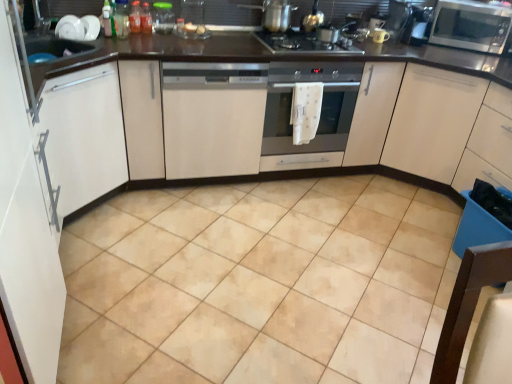
Measure the distance between point (125, 157) and camera.

Point (125, 157) and camera are 2.46 meters apart.

Identify the location of metallic gold kettle at upper center, the second appliance from the right. This screenshot has height=384, width=512. (313, 19).

Locate an element on the screen. This screenshot has width=512, height=384. translucent plastic bottle at upper center, the 1th bottle positioned from the right is located at coordinates (146, 19).

Find the location of a particular element. The width and height of the screenshot is (512, 384). white matte cabinet at left, which is the 2th cabinetry from left to right is located at coordinates (26, 229).

How much space does white matte cabinet at left, which ranks as the third cabinetry in right-to-left order, occupy horizontally?

white matte cabinet at left, which ranks as the third cabinetry in right-to-left order, is 13.08 inches in width.

Identify the location of white glossy cabinet at left, which is counted as the 1th cabinetry, starting from the left. (84, 135).

Is translucent plastic bottle at upper center, marked as the third bottle in a left-to-right arrangement, further to camera compared to matte ceramic mug at upper center, the first appliance from the right?

No, it is not.

Would you say translucent plastic bottle at upper center, the 1th bottle positioned from the right, contains matte ceramic mug at upper center, the first appliance from the right?

No, translucent plastic bottle at upper center, the 1th bottle positioned from the right, does not contain matte ceramic mug at upper center, the first appliance from the right.

Which is farther from the camera, (143,5) or (375,37)?

Positioned behind is point (375,37).

Which is more to the left, beige ceramic tile at center or matte white cabinet at right, which ranks as the fourth cabinetry in left-to-right order?

beige ceramic tile at center.

How different are the orientations of beige ceramic tile at center and matte white cabinet at right, which is counted as the first cabinetry, starting from the right, in degrees?

They differ by 88.3 degrees in their facing directions.

Is beige ceramic tile at center closer to camera compared to matte white cabinet at right, which is counted as the first cabinetry, starting from the right?

Yes, beige ceramic tile at center is closer to the camera.

From the image's perspective, starting from the beige ceramic tile at center, which bottle is the 1st one above? Please provide its 2D coordinates.

[(121, 19)]

Is beige ceramic tile at center not inside translucent plastic bottle at upper center, arranged as the first bottle when viewed from the left?

Indeed, beige ceramic tile at center is completely outside translucent plastic bottle at upper center, arranged as the first bottle when viewed from the left.

Measure the distance between beige ceramic tile at center and translucent plastic bottle at upper center, which is counted as the third bottle, starting from the right.

beige ceramic tile at center and translucent plastic bottle at upper center, which is counted as the third bottle, starting from the right, are 5.20 feet apart.

Is the depth of beige ceramic tile at center less than that of translucent plastic bottle at upper center, arranged as the first bottle when viewed from the left?

Yes, beige ceramic tile at center is in front of translucent plastic bottle at upper center, arranged as the first bottle when viewed from the left.

Based on the photo, from a real-world perspective, who is located higher, satin silver microwave at upper right or white glossy cabinet at left, which is counted as the 1th cabinetry, starting from the left?

satin silver microwave at upper right is physically above.

Can you confirm if satin silver microwave at upper right is positioned to the left of white glossy cabinet at left, which is counted as the 1th cabinetry, starting from the left?

No, satin silver microwave at upper right is not to the left of white glossy cabinet at left, which is counted as the 1th cabinetry, starting from the left.

Which point is more distant from viewer, (476,47) or (70,174)?

Positioned behind is point (476,47).

Which object is closer to the camera, satin silver microwave at upper right or white glossy cabinet at left, positioned as the fourth cabinetry in right-to-left order?

Positioned in front is white glossy cabinet at left, positioned as the fourth cabinetry in right-to-left order.

Is matte white cabinet at right, which ranks as the fourth cabinetry in left-to-right order, positioned behind satin silver oven at center?

Yes, matte white cabinet at right, which ranks as the fourth cabinetry in left-to-right order, is behind satin silver oven at center.

Considering the relative sizes of matte white cabinet at right, which ranks as the fourth cabinetry in left-to-right order, and satin silver oven at center in the image provided, is matte white cabinet at right, which ranks as the fourth cabinetry in left-to-right order, bigger than satin silver oven at center?

Correct, matte white cabinet at right, which ranks as the fourth cabinetry in left-to-right order, is larger in size than satin silver oven at center.

Based on the photo, can you confirm if matte white cabinet at right, which ranks as the fourth cabinetry in left-to-right order, is taller than satin silver oven at center?

Correct, matte white cabinet at right, which ranks as the fourth cabinetry in left-to-right order, is much taller as satin silver oven at center.

From a real-world perspective, does matte white cabinet at right, which ranks as the fourth cabinetry in left-to-right order, stand above satin silver oven at center?

No.

Is white glossy cabinet at left, positioned as the fourth cabinetry in right-to-left order, facing towards translucent plastic bottle at upper center, the 1th bottle positioned from the right?

No.

Based on the photo, which is in front, white glossy cabinet at left, positioned as the fourth cabinetry in right-to-left order, or translucent plastic bottle at upper center, the 1th bottle positioned from the right?

white glossy cabinet at left, positioned as the fourth cabinetry in right-to-left order, is in front.

Is white glossy cabinet at left, positioned as the fourth cabinetry in right-to-left order, with translucent plastic bottle at upper center, the 1th bottle positioned from the right?

They are not placed beside each other.

In the scene shown: Between white glossy cabinet at left, positioned as the fourth cabinetry in right-to-left order, and translucent plastic bottle at upper center, marked as the third bottle in a left-to-right arrangement, which one appears on the right side from the viewer's perspective?

translucent plastic bottle at upper center, marked as the third bottle in a left-to-right arrangement, is more to the right.

How many degrees apart are the facing directions of translucent plastic bottle at upper center, which is counted as the third bottle, starting from the right, and matte ceramic mug at upper center, the first appliance from the right?

translucent plastic bottle at upper center, which is counted as the third bottle, starting from the right, and matte ceramic mug at upper center, the first appliance from the right, are facing 18.9 degrees away from each other.

Considering the relative sizes of translucent plastic bottle at upper center, which is counted as the third bottle, starting from the right, and matte ceramic mug at upper center, marked as the third appliance in a left-to-right arrangement, in the image provided, is translucent plastic bottle at upper center, which is counted as the third bottle, starting from the right, bigger than matte ceramic mug at upper center, marked as the third appliance in a left-to-right arrangement,?

Yes.

Measure the distance between translucent plastic bottle at upper center, which is counted as the third bottle, starting from the right, and matte ceramic mug at upper center, the first appliance from the right.

translucent plastic bottle at upper center, which is counted as the third bottle, starting from the right, is 1.60 meters away from matte ceramic mug at upper center, the first appliance from the right.

From the image's perspective, between translucent plastic bottle at upper center, which is counted as the third bottle, starting from the right, and matte ceramic mug at upper center, marked as the third appliance in a left-to-right arrangement, who is located below?

From the image's view, translucent plastic bottle at upper center, which is counted as the third bottle, starting from the right, is below.

Where is `the 3rd appliance to the right of the translucent plastic bottle at upper center, the 1th bottle positioned from the right, starting your count from the anchor`? the 3rd appliance to the right of the translucent plastic bottle at upper center, the 1th bottle positioned from the right, starting your count from the anchor is located at coordinates (380, 35).

The width and height of the screenshot is (512, 384). What are the coordinates of `ceramic tile that is in front of the matte white cabinet at right, which ranks as the fourth cabinetry in left-to-right order` in the screenshot? It's located at (258, 284).

Which object lies nearer to the anchor point satin silver microwave at upper right, beige ceramic tile at center or translucent plastic bottle at upper center, which is counted as the third bottle, starting from the right?

beige ceramic tile at center is closer to satin silver microwave at upper right.

Which object lies further to the anchor point matte ceramic mug at upper center, the first appliance from the right, white glossy cabinet at left, positioned as the fourth cabinetry in right-to-left order, or matte white cabinet at right, which ranks as the fourth cabinetry in left-to-right order?

white glossy cabinet at left, positioned as the fourth cabinetry in right-to-left order.

Based on their spatial positions, is white matte dishwasher at center, the third cabinetry in the left-to-right sequence, or black glass gas stove at center further from matte white cabinet at right, which ranks as the fourth cabinetry in left-to-right order?

white matte dishwasher at center, the third cabinetry in the left-to-right sequence, lies further to matte white cabinet at right, which ranks as the fourth cabinetry in left-to-right order, than the other object.

From the image, which object appears to be nearer to transparent plastic container at upper center, which is counted as the third appliance, starting from the right, white glossy cabinet at left, positioned as the fourth cabinetry in right-to-left order, or white matte dishwasher at center, placed as the 2th cabinetry when sorted from right to left?

white matte dishwasher at center, placed as the 2th cabinetry when sorted from right to left, is positioned closer to the anchor transparent plastic container at upper center, which is counted as the third appliance, starting from the right.

Looking at the image, which one is located closer to blue plastic drawer at lower right, transparent plastic container at upper center, positioned as the 1th appliance in left-to-right order, or white glossy cabinet at left, positioned as the fourth cabinetry in right-to-left order?

transparent plastic container at upper center, positioned as the 1th appliance in left-to-right order.

Estimate the real-world distances between objects in this image. Which object is further from white matte cabinet at left, which is the 2th cabinetry from left to right, blue plastic drawer at lower right or metallic gold kettle at upper center, placed as the 2th appliance when sorted from left to right?

The object further to white matte cabinet at left, which is the 2th cabinetry from left to right, is blue plastic drawer at lower right.

Considering their positions, is metallic gold kettle at upper center, placed as the 2th appliance when sorted from left to right, positioned closer to white glossy cabinet at left, which is counted as the 1th cabinetry, starting from the left, than transparent plastic container at upper center, which is counted as the third appliance, starting from the right?

transparent plastic container at upper center, which is counted as the third appliance, starting from the right, is positioned closer to the anchor white glossy cabinet at left, which is counted as the 1th cabinetry, starting from the left.

When comparing their distances from white matte cabinet at left, which is the 2th cabinetry from left to right, does translucent plastic bottle at upper center, acting as the second bottle starting from the right, or white glossy cabinet at left, positioned as the fourth cabinetry in right-to-left order, seem closer?

white glossy cabinet at left, positioned as the fourth cabinetry in right-to-left order, lies closer to white matte cabinet at left, which is the 2th cabinetry from left to right, than the other object.

Identify the location of cabinetry between translucent plastic bottle at upper center, acting as the second bottle starting from the right, and satin silver oven at center, in the horizontal direction. (213, 118).

You are a GUI agent. You are given a task and a screenshot of the screen. Output one action in this format:
    pyautogui.click(x=<x>, y=<y>)
    Task: Click on the home appliance between white matte cabinet at left, which ranks as the third cabinetry in right-to-left order, and translucent plastic bottle at upper center, which is the second bottle from left to right, in the front-back direction
    
    Given the screenshot: What is the action you would take?
    pyautogui.click(x=321, y=107)

Locate an element on the screen. This screenshot has height=384, width=512. gas stove located between white glossy cabinet at left, positioned as the fourth cabinetry in right-to-left order, and satin silver microwave at upper right in the left-right direction is located at coordinates (304, 43).

Find the location of a particular element. This screenshot has width=512, height=384. ceramic tile between white glossy cabinet at left, which is counted as the 1th cabinetry, starting from the left, and matte ceramic mug at upper center, the first appliance from the right, in the horizontal direction is located at coordinates (258, 284).